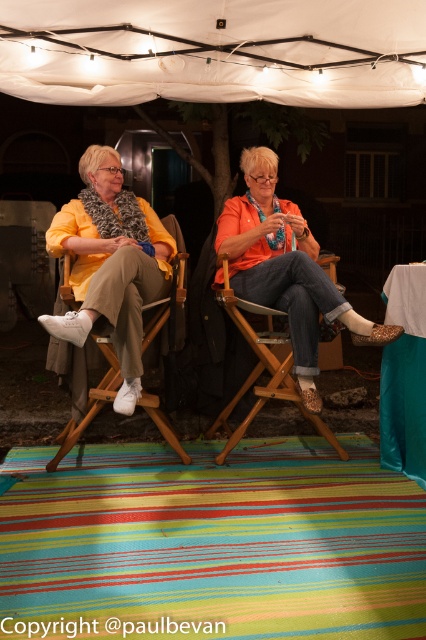
You are a photographer setting up a shot of the scene described. You want to ensure that the matte yellow jacket at center is framed larger in the photo than the wooden chair at center. Given their actual sizes, is this feasible?

The matte yellow jacket at center has a smaller size compared to wooden chair at center. To frame the matte yellow jacket at center larger than the wooden chair at center, you can position the matte yellow jacket at center closer to the camera while keeping the wooden chair at center farther away. This way, even though the jacket is physically smaller, its proximity to the camera will make it appear larger in the photo.

Based on the coordinates provided, which object is located at point (106, 273) in the image?

The point (106, 273) corresponds to the matte yellow jacket at center.